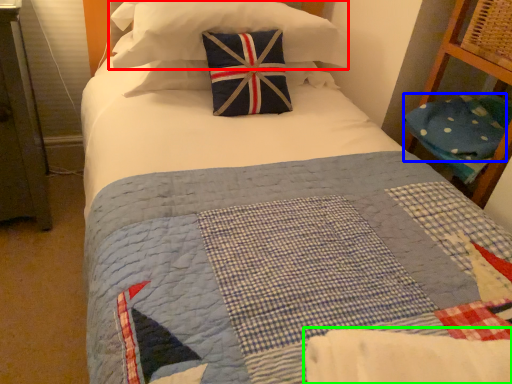
Question: Estimate the real-world distances between objects in this image. Which object is farther from pillow (highlighted by a red box), pillow (highlighted by a blue box) or blanket (highlighted by a green box)?

Choices:
 (A) pillow
 (B) blanket

Answer: (B)